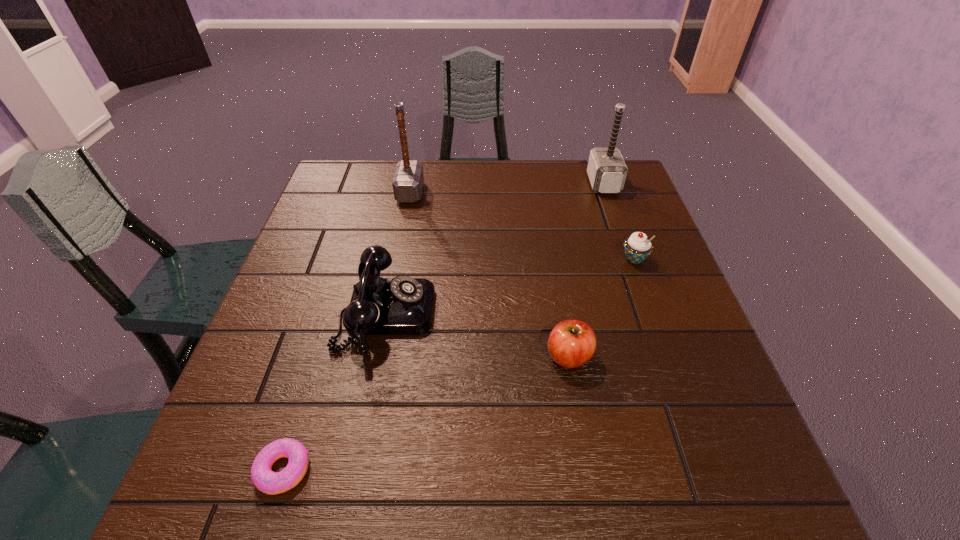
You are a GUI agent. You are given a task and a screenshot of the screen. Output one action in this format:
    pyautogui.click(x=<x>, y=<y>)
    Task: Click on the free point located 0.120m for striking with the head of the right hammer
    The width and height of the screenshot is (960, 540).
    Given the screenshot: What is the action you would take?
    pyautogui.click(x=549, y=184)

Where is `vacant space located on the dial of the third tallest object`? The height and width of the screenshot is (540, 960). vacant space located on the dial of the third tallest object is located at coordinates (597, 313).

Find the location of `vacant area located on the front of the cupcake`. vacant area located on the front of the cupcake is located at coordinates (674, 367).

You are a GUI agent. You are given a task and a screenshot of the screen. Output one action in this format:
    pyautogui.click(x=<x>, y=<y>)
    Task: Click on the free region located on the left of the fourth object from left to right
    
    Given the screenshot: What is the action you would take?
    pyautogui.click(x=495, y=356)

Locate an element on the screen. The width and height of the screenshot is (960, 540). free location located 0.100m on the back of the doughnut is located at coordinates (307, 392).

I want to click on object that is at the near edge, so click(265, 480).

You are a GUI agent. You are given a task and a screenshot of the screen. Output one action in this format:
    pyautogui.click(x=<x>, y=<y>)
    Task: Click on the telephone located at the left edge
    The width and height of the screenshot is (960, 540).
    Given the screenshot: What is the action you would take?
    pyautogui.click(x=402, y=305)

Identify the location of doughnut present at the left edge. (265, 480).

Where is `hammer at the right edge`? This screenshot has width=960, height=540. hammer at the right edge is located at coordinates (606, 169).

Find the location of `cupcake situated at the right edge`. cupcake situated at the right edge is located at coordinates (637, 247).